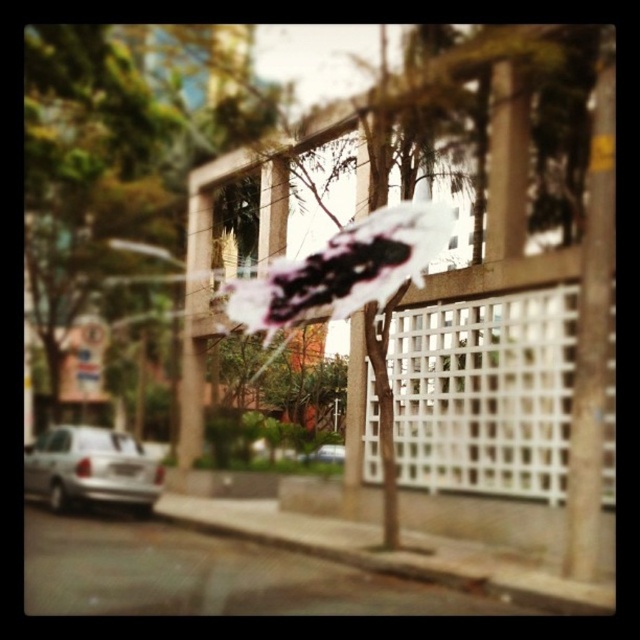
Who is positioned more to the right, white lattice fence at center or metallic pole at right?

metallic pole at right is more to the right.

Can you confirm if white lattice fence at center is shorter than metallic pole at right?

Yes.

The height and width of the screenshot is (640, 640). In order to click on white lattice fence at center in this screenshot , I will do `click(484, 394)`.

Which of these two, silver metallic car at lower left or silver metallic car at center, stands taller?

Standing taller between the two is silver metallic car at lower left.

You are a GUI agent. You are given a task and a screenshot of the screen. Output one action in this format:
    pyautogui.click(x=<x>, y=<y>)
    Task: Click on the silver metallic car at lower left
    The width and height of the screenshot is (640, 640).
    Given the screenshot: What is the action you would take?
    pyautogui.click(x=92, y=468)

Is white lattice fence at center positioned behind silver metallic car at center?

No, it is in front of silver metallic car at center.

Can you confirm if white lattice fence at center is taller than silver metallic car at center?

Correct, white lattice fence at center is much taller as silver metallic car at center.

What do you see at coordinates (484, 394) in the screenshot?
I see `white lattice fence at center` at bounding box center [484, 394].

This screenshot has height=640, width=640. What are the coordinates of `white lattice fence at center` in the screenshot? It's located at (484, 394).